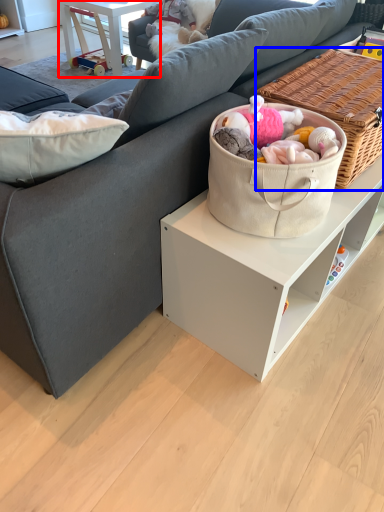
Question: Which object appears farthest to the camera in this image, table (highlighted by a red box) or picnic basket (highlighted by a blue box)?

Choices:
 (A) table
 (B) picnic basket

Answer: (A)